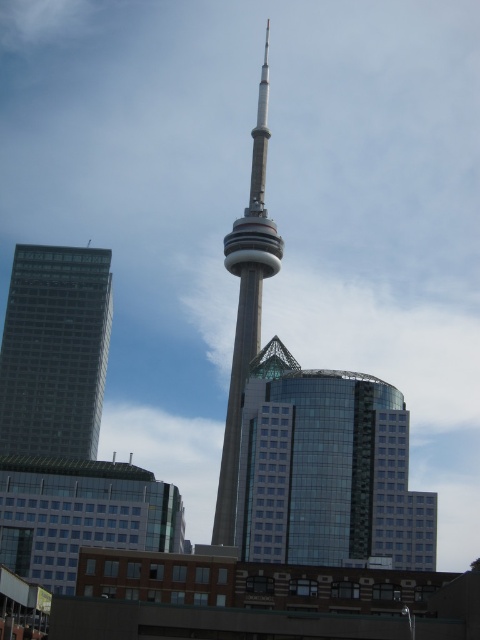
Can you confirm if green glass building at left is positioned to the left of glassy steel tower at center?

Yes, green glass building at left is to the left of glassy steel tower at center.

This screenshot has width=480, height=640. What do you see at coordinates (55, 349) in the screenshot? I see `green glass building at left` at bounding box center [55, 349].

Identify the location of green glass building at left. (55, 349).

Find the location of a particular element. The height and width of the screenshot is (640, 480). green glass building at left is located at coordinates (55, 349).